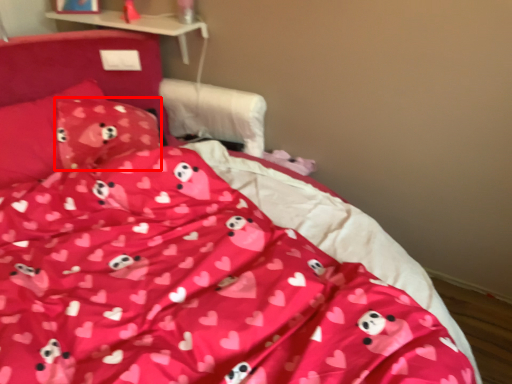
Question: From the image's perspective, where is pillow (annotated by the red box) located in relation to pillow in the image?

Choices:
 (A) above
 (B) below

Answer: (B)